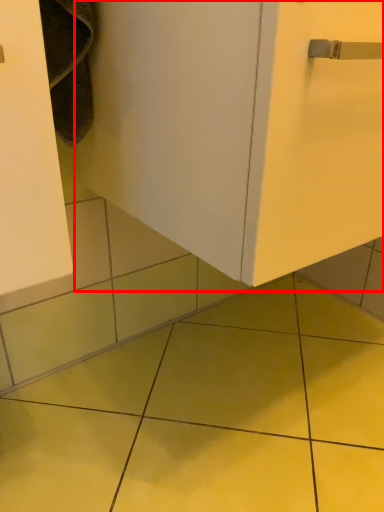
Question: From the image's perspective, what is the correct spatial relationship of door (annotated by the red box) in relation to ceramic tile?

Choices:
 (A) above
 (B) below

Answer: (A)